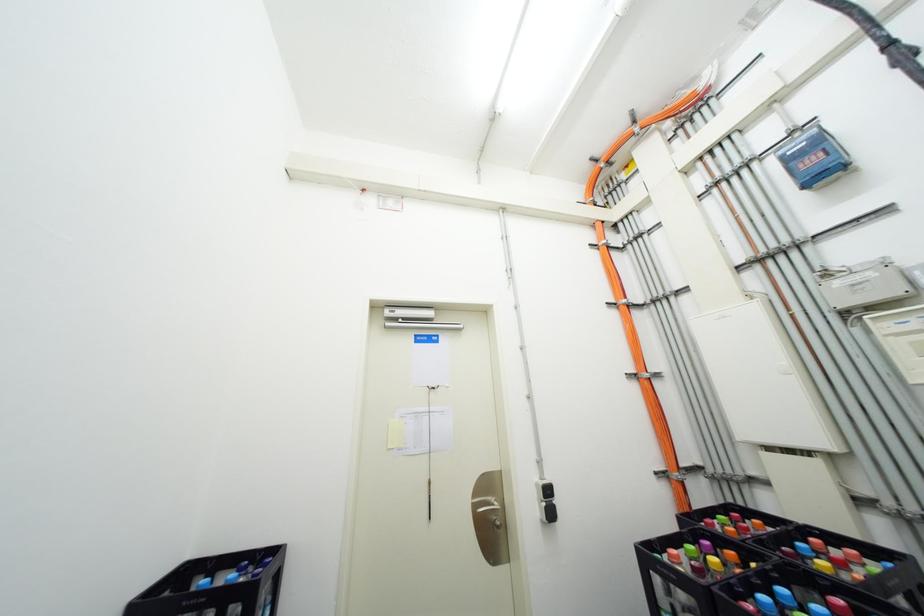
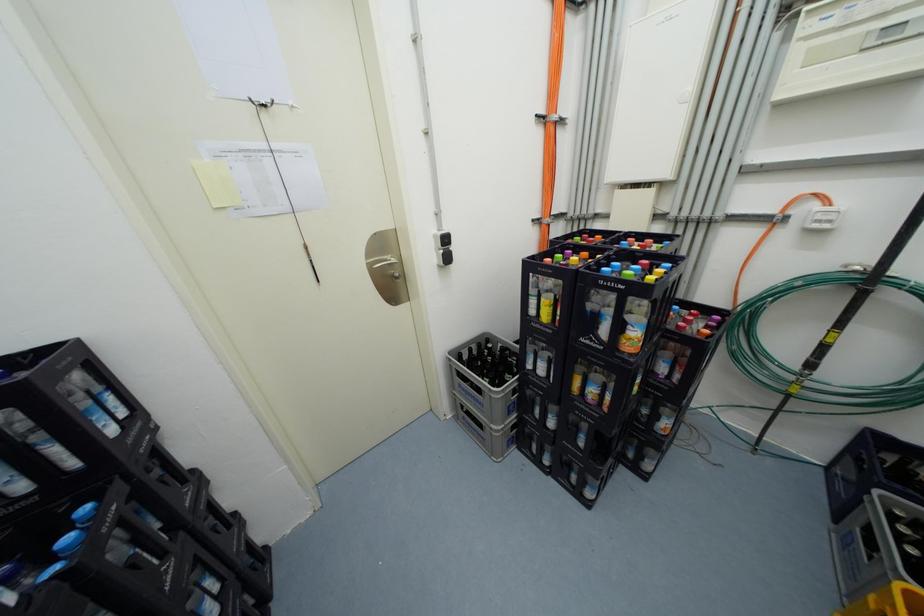
How did the camera likely rotate?

The camera's rotation is toward right-down.